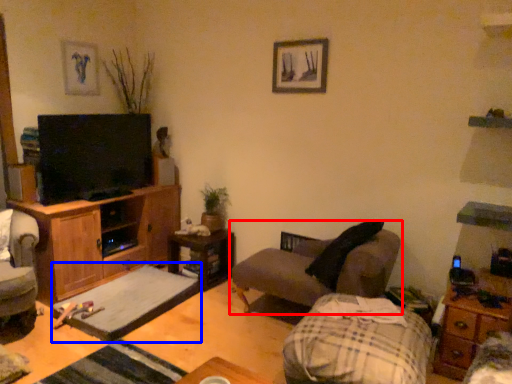
Question: Which of the following is the farthest to the observer, studio couch (highlighted by a red box) or footrest (highlighted by a blue box)?

Choices:
 (A) studio couch
 (B) footrest

Answer: (B)